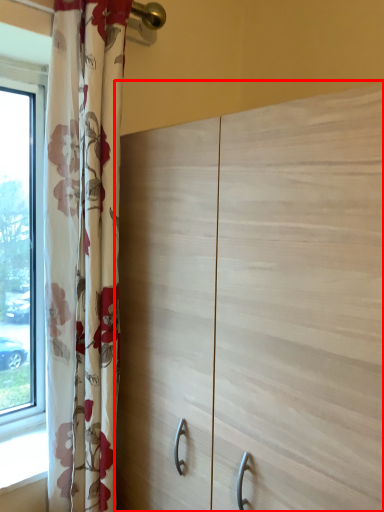
Question: From the image, what is the correct spatial relationship of cupboard (annotated by the red box) in relation to curtain?

Choices:
 (A) left
 (B) right

Answer: (B)